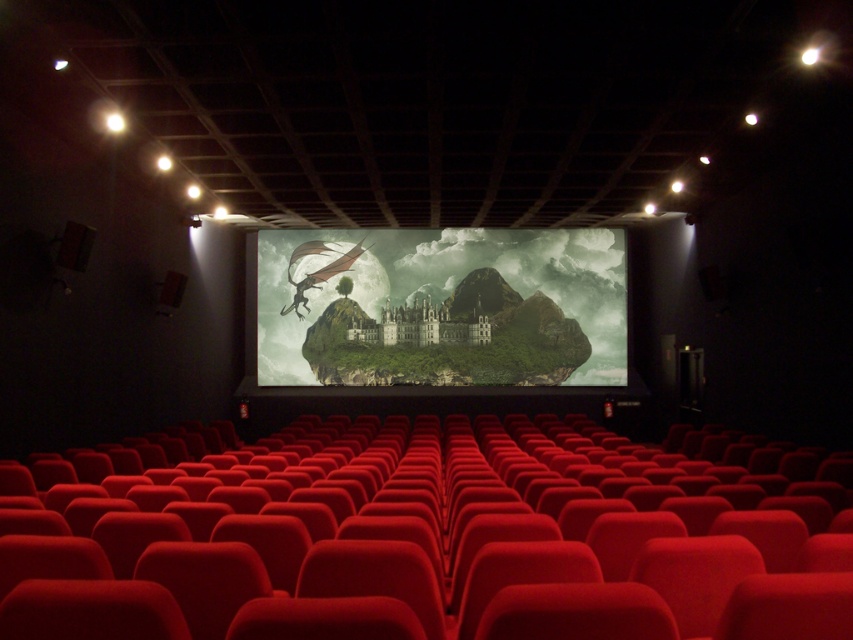
Question: Which object appears farthest from the camera in this image?

Choices:
 (A) velvet red seat at center
 (B) green matte island at center

Answer: (B)

Question: Does velvet red seat at center have a larger size compared to green matte island at center?

Choices:
 (A) yes
 (B) no

Answer: (B)

Question: Is the position of velvet red seat at center more distant than that of green matte island at center?

Choices:
 (A) yes
 (B) no

Answer: (B)

Question: Can you confirm if velvet red seat at center is smaller than green matte island at center?

Choices:
 (A) yes
 (B) no

Answer: (A)